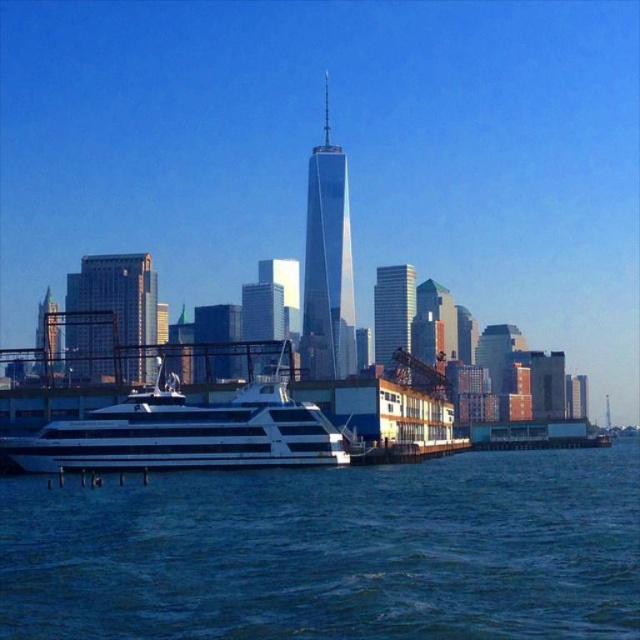
You are a photographer standing on the ferry boat and want to capture both the blue water at lower center and the shiny glass skyscraper at center in your shot. Which one will appear taller in the photograph?

The shiny glass skyscraper at center appears taller in the photograph because it is taller than the blue water at lower center according to the description.

You are a photographer planning to capture the entire scene of the blue water at lower center and the white glossy cruise ship at lower left in one shot. Based on their widths, which one will occupy more space horizontally in the photo?

The blue water at lower center will occupy more space horizontally in the photo because its width surpasses that of the white glossy cruise ship at lower left.